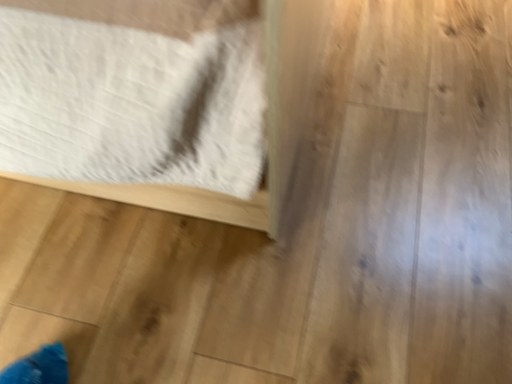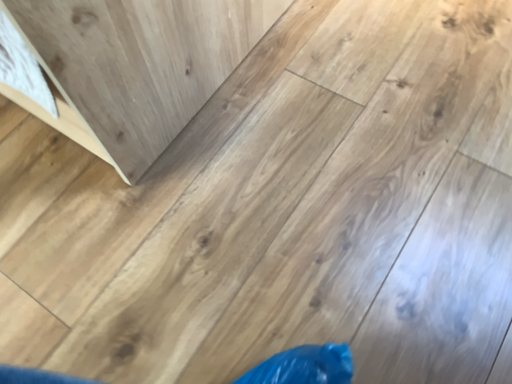
Question: How did the camera likely rotate when shooting the video?

Choices:
 (A) rotated right
 (B) rotated left

Answer: (B)